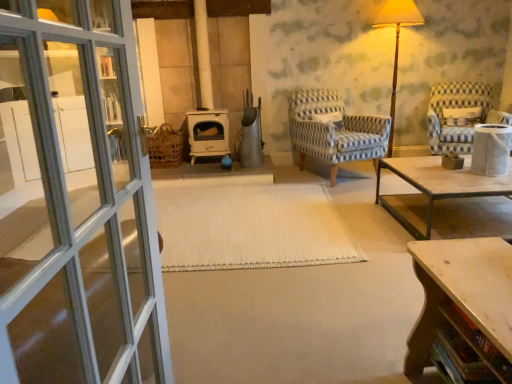
Question: Is point (456, 130) closer or farther from the camera than point (487, 281)?

Choices:
 (A) farther
 (B) closer

Answer: (A)

Question: Is blue and white patterned fabric armchair at right, which is counted as the first chair, starting from the right, in front of or behind wooden table at lower right in the image?

Choices:
 (A) front
 (B) behind

Answer: (B)

Question: Based on their relative distances, which object is nearer to the white textured mat at center?

Choices:
 (A) wooden floor lamp at upper right
 (B) wooden table at lower right
 (C) wooden side table at right
 (D) blue and white patterned fabric armchair at right, which is the second chair in left-to-right order
 (E) blue-patterned fabric chair at center, the 1th chair when ordered from left to right

Answer: (E)

Question: Considering the real-world distances, which object is closest to the wooden floor lamp at upper right?

Choices:
 (A) wooden table at lower right
 (B) blue and white patterned fabric armchair at right, which is counted as the first chair, starting from the right
 (C) white textured mat at center
 (D) wooden side table at right
 (E) blue-patterned fabric chair at center, the 1th chair when ordered from left to right

Answer: (B)